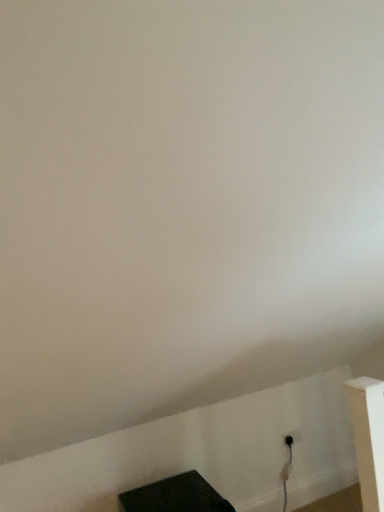
Question: Is black matte tv at lower center outside black plastic outlet at lower right?

Choices:
 (A) yes
 (B) no

Answer: (A)

Question: Is black matte tv at lower center not close to black plastic outlet at lower right?

Choices:
 (A) no
 (B) yes

Answer: (A)

Question: Considering the relative sizes of black matte tv at lower center and black plastic outlet at lower right in the image provided, is black matte tv at lower center taller than black plastic outlet at lower right?

Choices:
 (A) yes
 (B) no

Answer: (A)

Question: Considering the relative sizes of black matte tv at lower center and black plastic outlet at lower right in the image provided, is black matte tv at lower center wider than black plastic outlet at lower right?

Choices:
 (A) yes
 (B) no

Answer: (A)

Question: From a real-world perspective, is black matte tv at lower center physically above black plastic outlet at lower right?

Choices:
 (A) yes
 (B) no

Answer: (B)

Question: Is black matte tv at lower center bigger than black plastic outlet at lower right?

Choices:
 (A) yes
 (B) no

Answer: (A)

Question: Is black plastic outlet at lower right smaller than black matte tv at lower center?

Choices:
 (A) no
 (B) yes

Answer: (B)

Question: Is black plastic outlet at lower right facing towards black matte tv at lower center?

Choices:
 (A) yes
 (B) no

Answer: (B)

Question: Is black matte tv at lower center surrounded by black plastic outlet at lower right?

Choices:
 (A) no
 (B) yes

Answer: (A)

Question: From the image's perspective, is black plastic outlet at lower right above black matte tv at lower center?

Choices:
 (A) yes
 (B) no

Answer: (A)

Question: Is black plastic outlet at lower right far from black matte tv at lower center?

Choices:
 (A) yes
 (B) no

Answer: (B)

Question: Does black plastic outlet at lower right have a greater width compared to black matte tv at lower center?

Choices:
 (A) no
 (B) yes

Answer: (A)

Question: Considering the positions of black matte tv at lower center and black plastic outlet at lower right in the image, is black matte tv at lower center wider or thinner than black plastic outlet at lower right?

Choices:
 (A) wide
 (B) thin

Answer: (A)